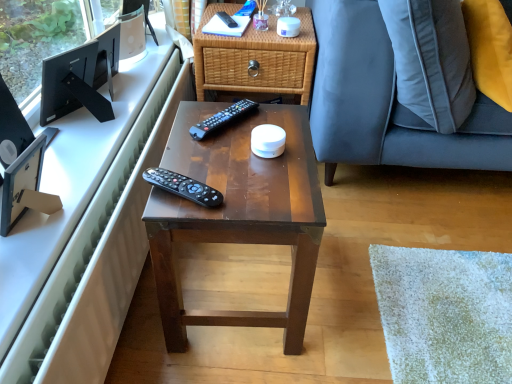
Where is `free region under brown polished wood desk at center (from a real-world perspective)`? The height and width of the screenshot is (384, 512). free region under brown polished wood desk at center (from a real-world perspective) is located at coordinates (234, 284).